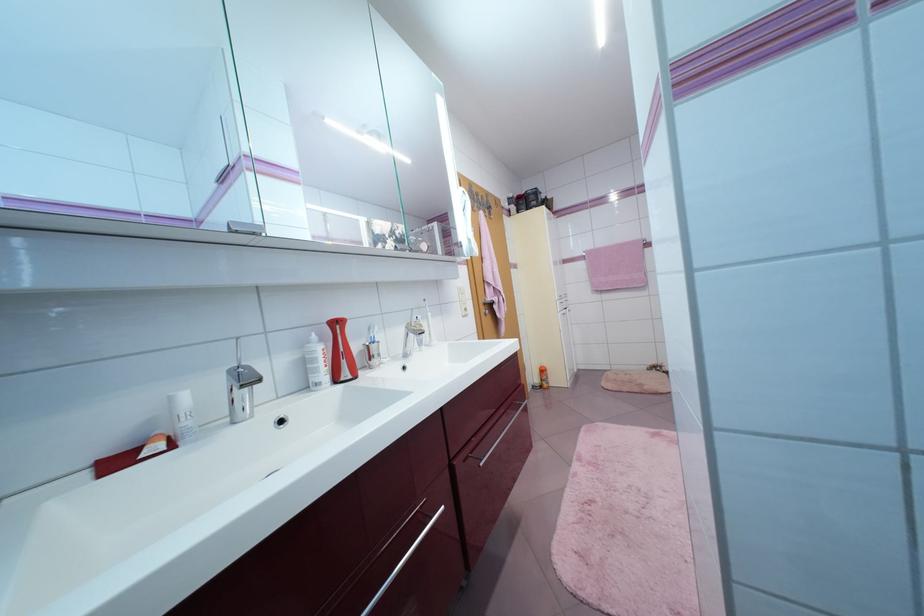
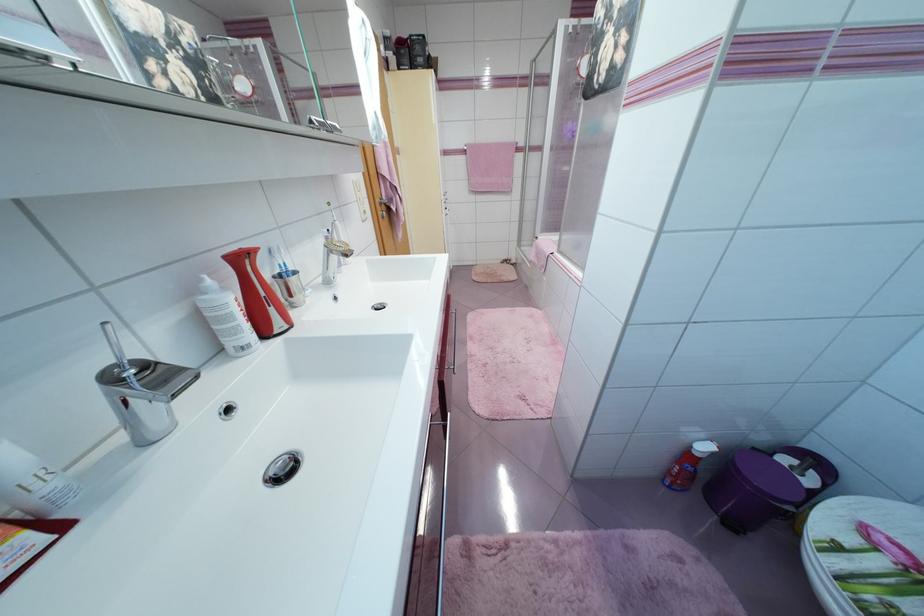
First-person continuous shooting, in which direction is the camera rotating?

The rotation direction of the camera is right-down.